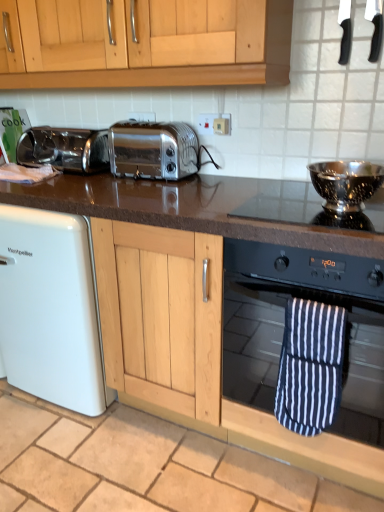
The height and width of the screenshot is (512, 384). In order to click on free spot in front of satin chrome toaster at center, the 2th toaster in the left-to-right sequence in this screenshot , I will do `click(140, 194)`.